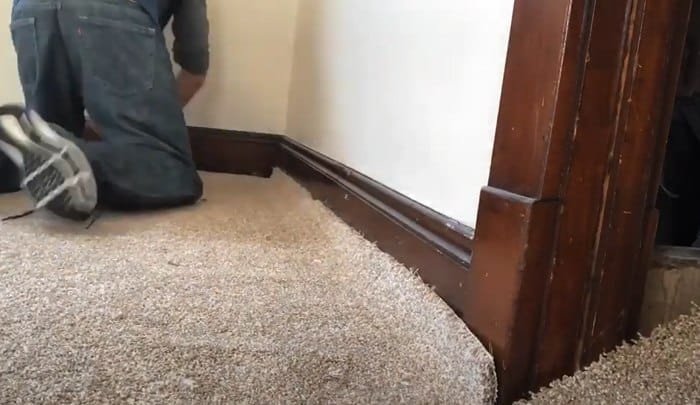
At what (x,y) coordinates should I click in order to perform the action: click on beige carpets. Please return your answer as a coordinate pair (x, y). The image size is (700, 405). Looking at the image, I should click on (265, 279), (628, 369).